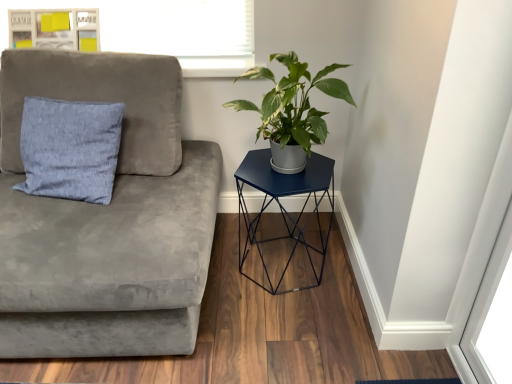
Question: From the image's perspective, would you say suede gray couch at left is shown under light blue fabric pillow at left?

Choices:
 (A) yes
 (B) no

Answer: (A)

Question: Is light blue fabric pillow at left at the back of suede gray couch at left?

Choices:
 (A) yes
 (B) no

Answer: (A)

Question: Could you tell me if suede gray couch at left is facing light blue fabric pillow at left?

Choices:
 (A) no
 (B) yes

Answer: (B)

Question: Is suede gray couch at left not inside light blue fabric pillow at left?

Choices:
 (A) no
 (B) yes

Answer: (B)

Question: From a real-world perspective, is suede gray couch at left over light blue fabric pillow at left?

Choices:
 (A) no
 (B) yes

Answer: (A)

Question: Is wooden frame at upper left situated inside light blue fabric pillow at left or outside?

Choices:
 (A) inside
 (B) outside

Answer: (B)

Question: Is wooden frame at upper left wider or thinner than light blue fabric pillow at left?

Choices:
 (A) thin
 (B) wide

Answer: (A)

Question: From a real-world perspective, relative to light blue fabric pillow at left, is wooden frame at upper left vertically above or below?

Choices:
 (A) below
 (B) above

Answer: (B)

Question: Is wooden frame at upper left taller or shorter than light blue fabric pillow at left?

Choices:
 (A) tall
 (B) short

Answer: (B)

Question: Is point (246, 244) positioned closer to the camera than point (250, 102)?

Choices:
 (A) farther
 (B) closer

Answer: (A)

Question: Looking at the image, does metallic blue hexagonal table at right seem bigger or smaller compared to green matte plant at upper right?

Choices:
 (A) small
 (B) big

Answer: (B)

Question: Would you say metallic blue hexagonal table at right is to the left or to the right of green matte plant at upper right in the picture?

Choices:
 (A) left
 (B) right

Answer: (B)

Question: Is metallic blue hexagonal table at right inside or outside of green matte plant at upper right?

Choices:
 (A) outside
 (B) inside

Answer: (A)

Question: From the image's perspective, is suede gray couch at left positioned above or below wooden frame at upper left?

Choices:
 (A) above
 (B) below

Answer: (B)

Question: Would you say suede gray couch at left is inside or outside wooden frame at upper left?

Choices:
 (A) outside
 (B) inside

Answer: (A)